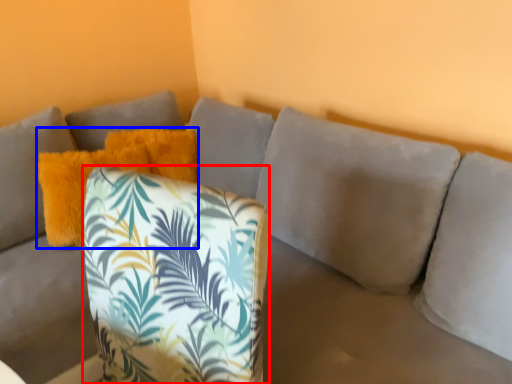
Question: Which object is closer to the camera taking this photo, throw pillow (highlighted by a red box) or pillow (highlighted by a blue box)?

Choices:
 (A) throw pillow
 (B) pillow

Answer: (A)